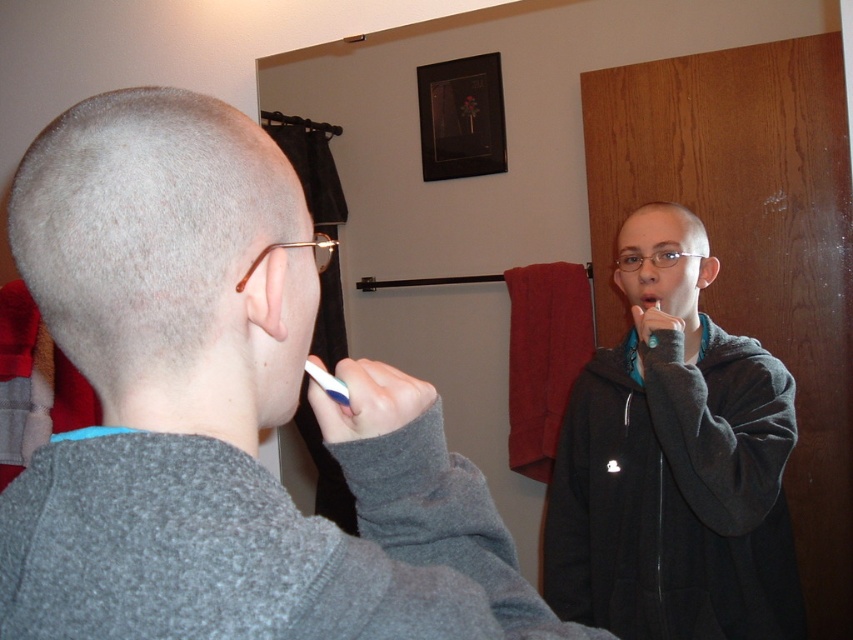
You are standing in the bathroom and see two points marked on the wall. The first point is at coordinate point(318, 385) and the second is at point(656, 300). Which point is closer to you?

The point at coordinate point(318, 385) is closer to the viewer than point(656, 300).

You are standing in the bathroom and want to place a 12 inch ruler on the floor so that it reaches from the point at coordinates point (131, 422) to the wall behind you. Is the ruler long enough?

The distance between point (131, 422) and the viewer is 18.19 inches. Since the ruler is only 12 inches long, it is not long enough to reach from the point to the wall behind you.

You are standing in the bathroom and need to place a new towel on the towel rack. The rack is at point (675,493). Where should you put the new towel?

The black fleece sweatshirt at right is located at point (675,493), so you should place the new towel there.